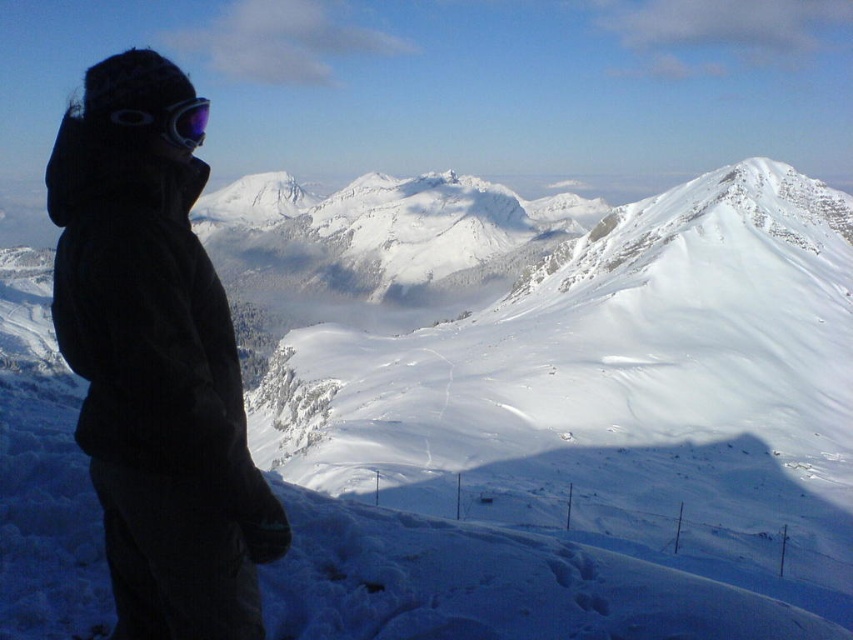
Between black fleece jacket at left and matte purple goggles at upper left, which one is positioned higher?

matte purple goggles at upper left

Is black fleece jacket at left in front of matte purple goggles at upper left?

Yes, it is in front of matte purple goggles at upper left.

I want to click on black fleece jacket at left, so click(x=155, y=369).